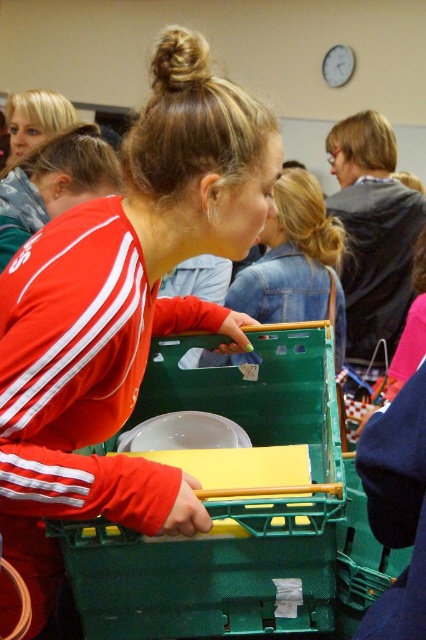
Between matte red jacket at center and matte plastic shopping cart at center, which one is positioned lower?

matte red jacket at center

Which is above, matte red jacket at center or matte plastic shopping cart at center?

Positioned higher is matte plastic shopping cart at center.

Which is in front, point (72, 401) or point (342, 356)?

Positioned in front is point (72, 401).

Image resolution: width=426 pixels, height=640 pixels. In order to click on matte red jacket at center in this screenshot , I will do `click(123, 310)`.

Does green plastic crate at center have a lesser width compared to matte plastic shopping cart at center?

In fact, green plastic crate at center might be wider than matte plastic shopping cart at center.

Between green plastic crate at center and matte plastic shopping cart at center, which one appears on the right side from the viewer's perspective?

From the viewer's perspective, matte plastic shopping cart at center appears more on the right side.

Between point (293, 484) and point (293, 252), which one is positioned behind?

Positioned behind is point (293, 252).

Where is `green plastic crate at center`? green plastic crate at center is located at coordinates (226, 506).

Is matte red jacket at center positioned before green plastic crate at center?

That is True.

Does matte red jacket at center have a lesser width compared to green plastic crate at center?

Yes.

Where is `matte red jacket at center`? matte red jacket at center is located at coordinates (123, 310).